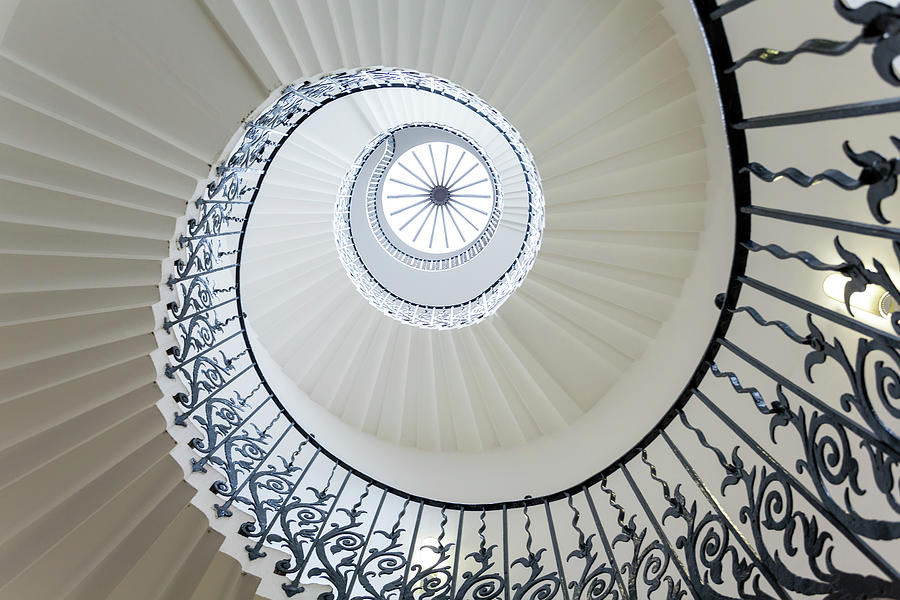
At what (x,y) coordinates should I click in order to perform the action: click on bottom of lights. Please return your answer as a coordinate pair (x, y). Looking at the image, I should click on (886, 306), (423, 583).